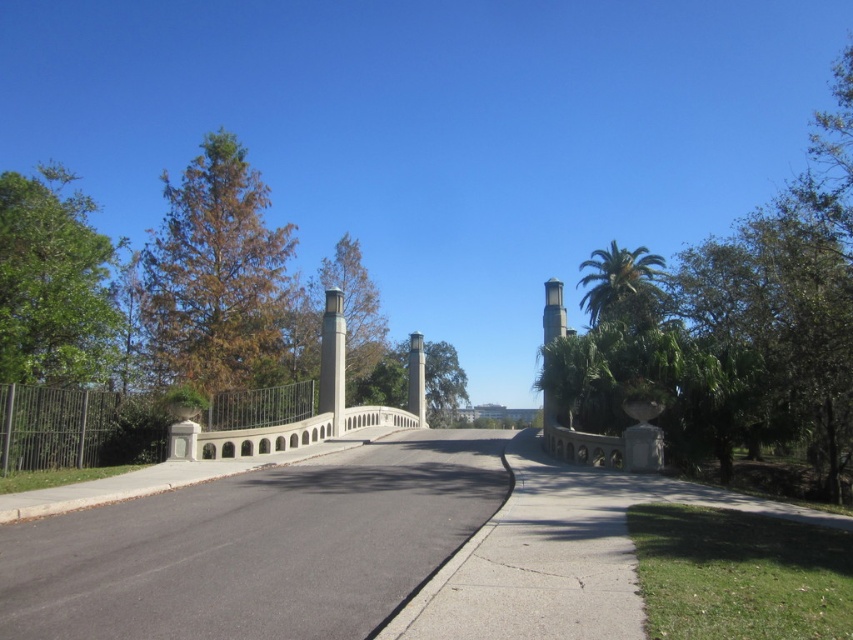
You are standing at the camera position and want to walk to point (335, 349). The path is 100 feet long. Is the point within the path length?

The distance between the camera and point (335, 349) is 84.84 feet, which is less than the path length of 100 feet. Therefore, the point is within the path length.